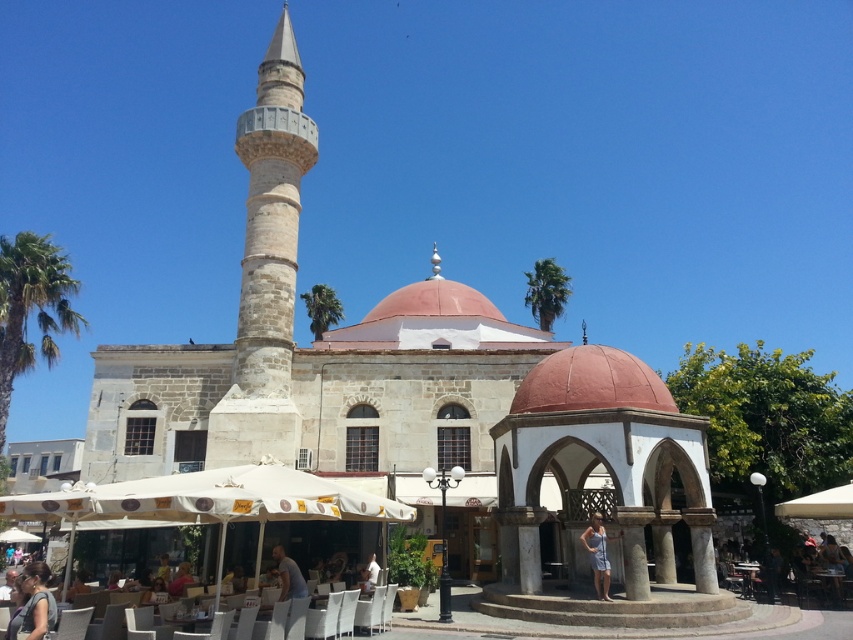
You are a tourist visiting the historical site and want to take a photo of the blue striped dress at center and the wooden table at center. Which object should you focus on first to ensure both are in the frame?

You should focus on the wooden table at center first because the blue striped dress at center is in front of it, ensuring both will be visible in the frame.

You are a photographer planning to capture the historical building with both the green leafy palm tree at left and the light blue fabric shirt at lower center in the frame. Which object occupies more horizontal space in the photo?

The green leafy palm tree at left has a greater width than the light blue fabric shirt at lower center, so it occupies more horizontal space in the photo.

You are standing at the entrance of the historical building and want to greet the woman wearing the blue striped dress at center. In which direction should you walk to reach her?

The blue striped dress at center is located at coordinates approximately 0.867 on the x axis and 0.702 on the y axis. Since you are at the entrance of the building, which is likely positioned at the front of the image, you should walk towards the center of the image where the pavilion and the dress are located. However, without specific directional mapping, the best approximation is to move forward towards the pavilion area where the dress is centered.